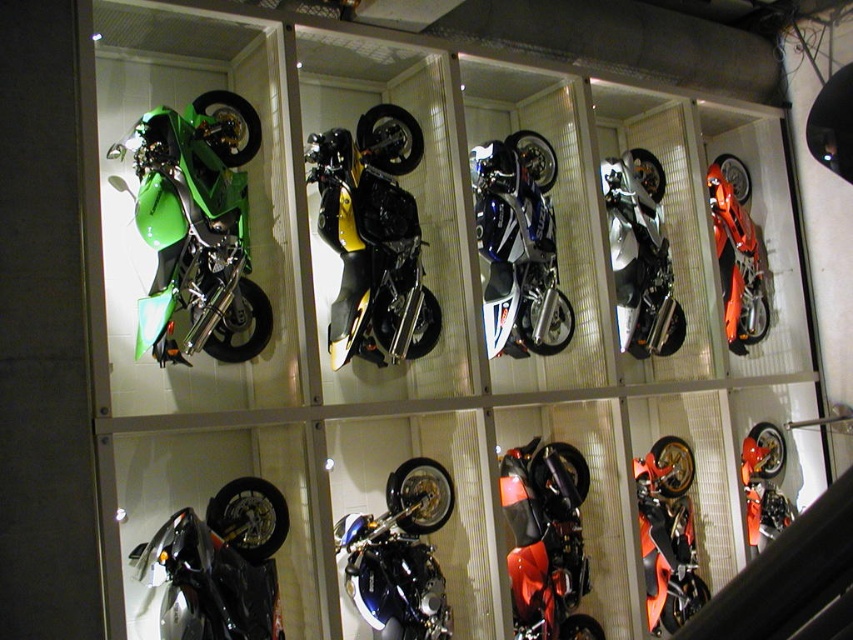
Can you confirm if glossy black motorcycle at lower left is smaller than shiny red motorcycle at center?

Correct, glossy black motorcycle at lower left occupies less space than shiny red motorcycle at center.

Between point (196, 529) and point (547, 600), which one is positioned behind?

Positioned behind is point (547, 600).

Find the location of a particular element. This screenshot has width=853, height=640. glossy black motorcycle at lower left is located at coordinates (219, 564).

Can you confirm if white matte/silver motorcycle at center is positioned below shiny orange motorcycle at right?

Yes.

The image size is (853, 640). What do you see at coordinates (518, 246) in the screenshot? I see `white matte/silver motorcycle at center` at bounding box center [518, 246].

Image resolution: width=853 pixels, height=640 pixels. I want to click on white matte/silver motorcycle at center, so click(518, 246).

Which is above, green matte/satin motorcycle at upper left or shiny orange motorcycle at bottom right?

green matte/satin motorcycle at upper left

In order to click on green matte/satin motorcycle at upper left in this screenshot , I will do `click(196, 228)`.